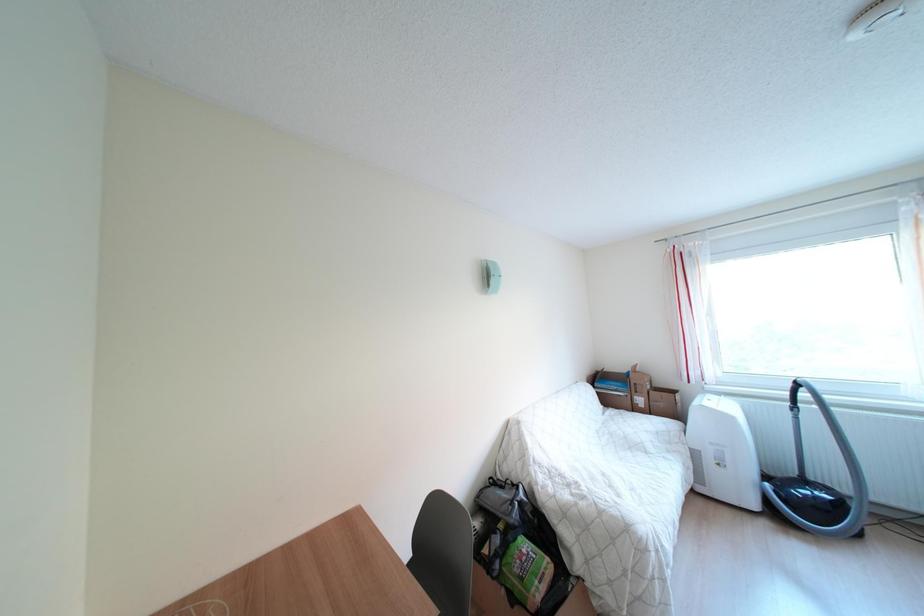
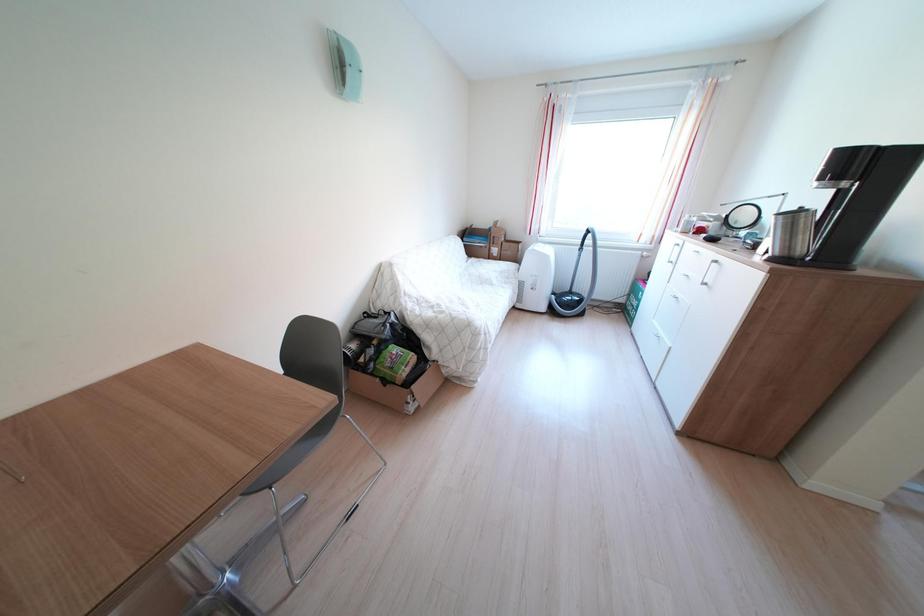
The first image is from the beginning of the video and the second image is from the end. How did the camera likely rotate when shooting the video?

The camera rotated toward right-down.